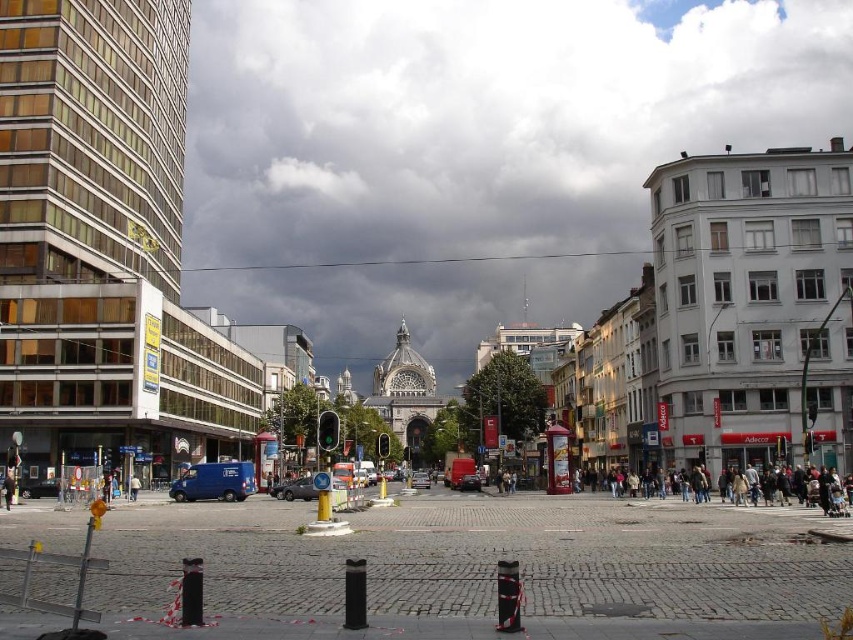
Question: Is the position of cloudy sky at center less distant than that of shiny silver car at center?

Choices:
 (A) no
 (B) yes

Answer: (A)

Question: Considering the relative positions of shiny silver car at center and metallic silver car at center in the image provided, where is shiny silver car at center located with respect to metallic silver car at center?

Choices:
 (A) left
 (B) right

Answer: (A)

Question: Among these points, which one is farthest from the camera?

Choices:
 (A) (425, 476)
 (B) (287, 486)
 (C) (445, 268)

Answer: (C)

Question: Which point is closer to the camera?

Choices:
 (A) cloudy sky at center
 (B) shiny silver car at center
 (C) metallic silver car at center

Answer: (B)

Question: Considering the relative positions of cloudy sky at center and shiny silver car at center in the image provided, where is cloudy sky at center located with respect to shiny silver car at center?

Choices:
 (A) right
 (B) left

Answer: (A)

Question: Which object appears closest to the camera in this image?

Choices:
 (A) shiny silver car at center
 (B) metallic silver car at center

Answer: (A)